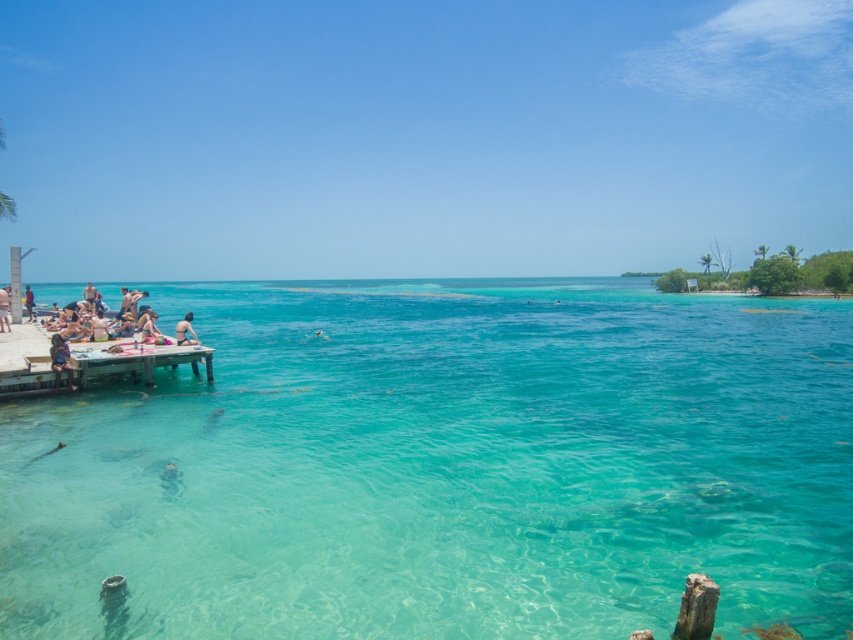
Question: Considering the real-world distances, which object is farthest from the multicolored fabric bag at left?

Choices:
 (A) tan skin person at left
 (B) wooden dock at lower left
 (C) matte black person at left
 (D) light brown skin at center

Answer: (C)

Question: Can you confirm if clear water at center is smaller than multicolored fabric bag at left?

Choices:
 (A) no
 (B) yes

Answer: (A)

Question: Among these points, which one is nearest to the camera?

Choices:
 (A) (195, 340)
 (B) (193, 356)
 (C) (54, 390)

Answer: (C)

Question: Can you confirm if tan skin person at left is positioned above matte black person at left?

Choices:
 (A) yes
 (B) no

Answer: (B)

Question: Among these points, which one is nearest to the camera?

Choices:
 (A) (x=73, y=353)
 (B) (x=28, y=298)

Answer: (A)

Question: Observing the image, what is the correct spatial positioning of clear water at center in reference to multicolored fabric bag at left?

Choices:
 (A) above
 (B) below

Answer: (A)